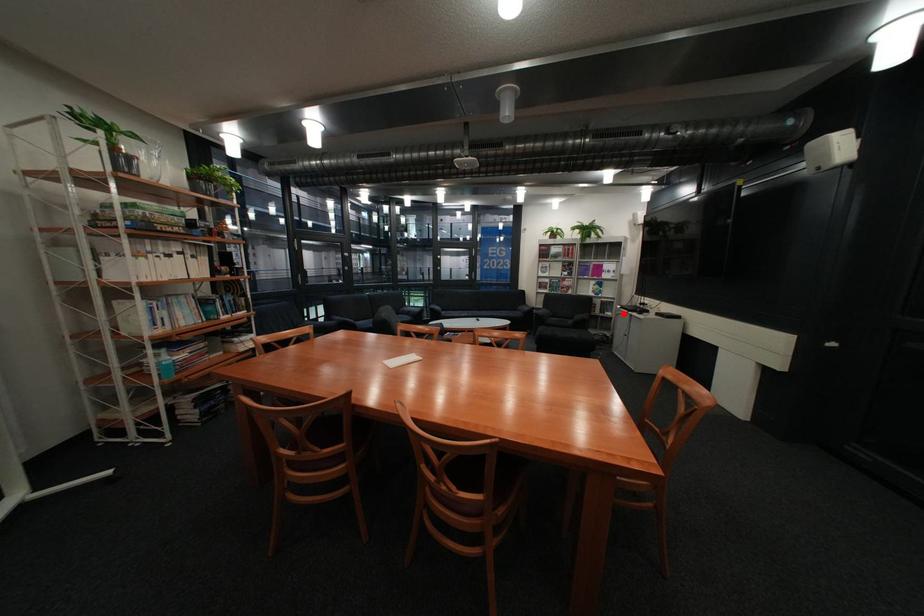
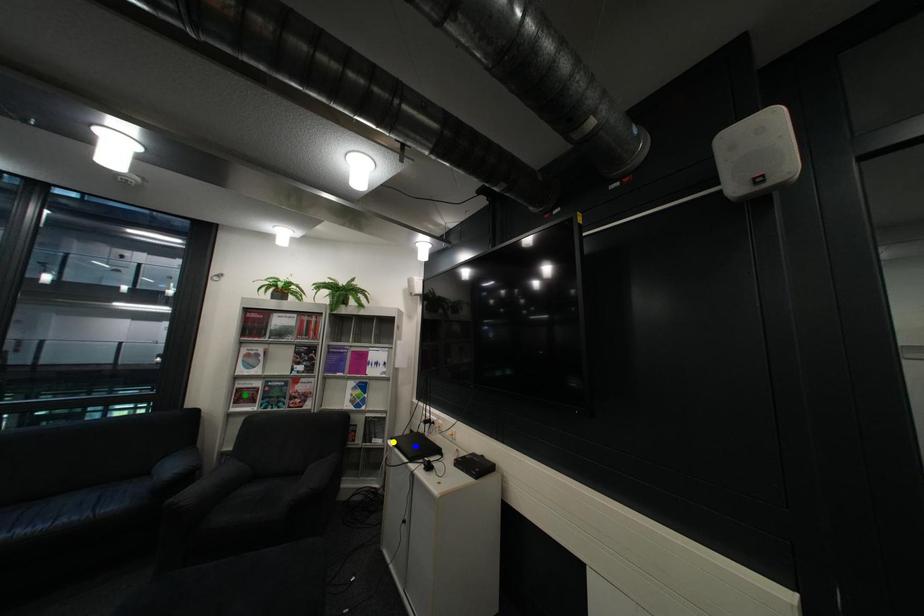
Question: I am providing you with two images of the same scene from different viewpoints. A red point is marked on the first image. You are given multiple points on the second image. Which point in image 2 is actually the same real-world point as the red point in image 1?

Choices:
 (A) blue point
 (B) green point
 (C) yellow point

Answer: (C)